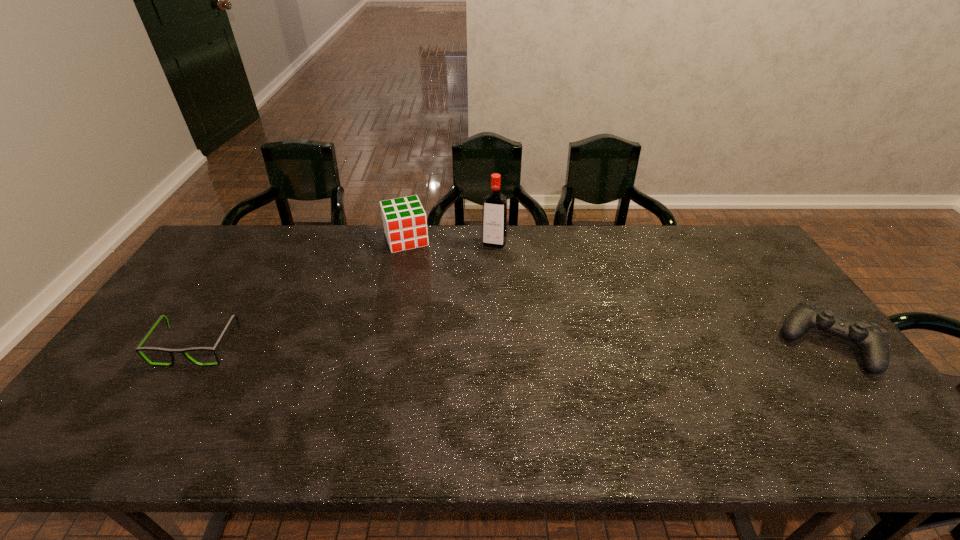
Identify the location of vacant region at the far edge of the desktop. (357, 233).

The height and width of the screenshot is (540, 960). In the image, there is a desktop. What are the coordinates of `vacant region at the near edge` in the screenshot? It's located at (308, 390).

The image size is (960, 540). In order to click on free point at the left edge in this screenshot , I will do `click(163, 341)`.

At what (x,y) coordinates should I click in order to perform the action: click on blank space at the right edge of the desktop. Please return your answer as a coordinate pair (x, y). The height and width of the screenshot is (540, 960). Looking at the image, I should click on (732, 272).

Locate an element on the screen. This screenshot has width=960, height=540. free space at the far right corner is located at coordinates [x=726, y=255].

The image size is (960, 540). Find the location of `free space that is in between the cube and the shortest object`. free space that is in between the cube and the shortest object is located at coordinates (301, 293).

Locate an element on the screen. The image size is (960, 540). vacant region between the tallest object and the shortest object is located at coordinates (346, 295).

You are a GUI agent. You are given a task and a screenshot of the screen. Output one action in this format:
    pyautogui.click(x=<x>, y=<y>)
    Task: Click on the vacant space that is in between the third shortest object and the tallest object
    The width and height of the screenshot is (960, 540).
    Given the screenshot: What is the action you would take?
    pyautogui.click(x=450, y=241)

Identify the location of vacant area that lies between the cube and the leftmost object. This screenshot has width=960, height=540. (301, 293).

Identify the location of free space between the third object from left to right and the third shortest object. (450, 241).